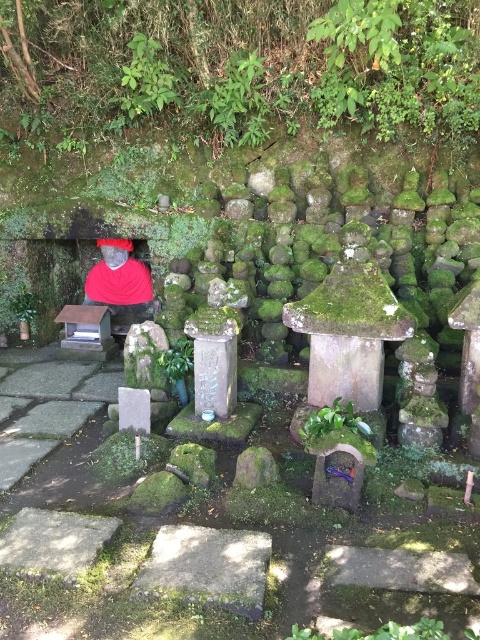
Question: Among these points, which one is nearest to the camera?

Choices:
 (A) 316,412
 (B) 144,312

Answer: (A)

Question: Among these points, which one is farthest from the camera?

Choices:
 (A) (338, 413)
 (B) (436, 81)
 (C) (115, 314)

Answer: (C)

Question: Can you confirm if green mossy rocks at upper center is smaller than green leafy plant at center?

Choices:
 (A) no
 (B) yes

Answer: (A)

Question: Which of the following is the closest to the observer?

Choices:
 (A) (10, 77)
 (B) (124, 282)
 (C) (337, 410)

Answer: (C)

Question: Does green mossy rocks at upper center have a larger size compared to matte red shirt at left?

Choices:
 (A) yes
 (B) no

Answer: (A)

Question: Is matte red shirt at left smaller than green leafy plant at center?

Choices:
 (A) no
 (B) yes

Answer: (A)